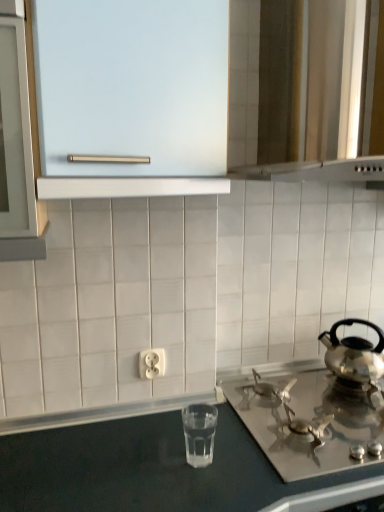
Question: Should I look upward or downward to see shiny silver kettle at right?

Choices:
 (A) down
 (B) up

Answer: (A)

Question: Considering the relative positions of clear glass water at lower center and shiny silver kettle at right in the image provided, is clear glass water at lower center to the right of shiny silver kettle at right from the viewer's perspective?

Choices:
 (A) yes
 (B) no

Answer: (B)

Question: Is clear glass water at lower center aimed at shiny silver kettle at right?

Choices:
 (A) yes
 (B) no

Answer: (B)

Question: Is clear glass water at lower center not near shiny silver kettle at right?

Choices:
 (A) no
 (B) yes

Answer: (A)

Question: Is clear glass water at lower center in front of shiny silver kettle at right?

Choices:
 (A) no
 (B) yes

Answer: (B)

Question: Considering the relative sizes of clear glass water at lower center and shiny silver kettle at right in the image provided, is clear glass water at lower center wider than shiny silver kettle at right?

Choices:
 (A) no
 (B) yes

Answer: (A)

Question: From the image's perspective, is clear glass water at lower center on shiny silver kettle at right?

Choices:
 (A) no
 (B) yes

Answer: (A)

Question: Is satin silver gas stove at lower right bigger than shiny silver kettle at right?

Choices:
 (A) yes
 (B) no

Answer: (A)

Question: Is satin silver gas stove at lower right not close to shiny silver kettle at right?

Choices:
 (A) yes
 (B) no

Answer: (B)

Question: Is satin silver gas stove at lower right to the right of shiny silver kettle at right from the viewer's perspective?

Choices:
 (A) no
 (B) yes

Answer: (A)

Question: From a real-world perspective, is satin silver gas stove at lower right over shiny silver kettle at right?

Choices:
 (A) no
 (B) yes

Answer: (A)

Question: From a real-world perspective, is satin silver gas stove at lower right under shiny silver kettle at right?

Choices:
 (A) no
 (B) yes

Answer: (B)

Question: From the image's perspective, is satin silver gas stove at lower right on shiny silver kettle at right?

Choices:
 (A) yes
 (B) no

Answer: (B)

Question: Can you confirm if frosted glass cabinet at upper center is taller than metallic silver vent at upper right?

Choices:
 (A) yes
 (B) no

Answer: (B)